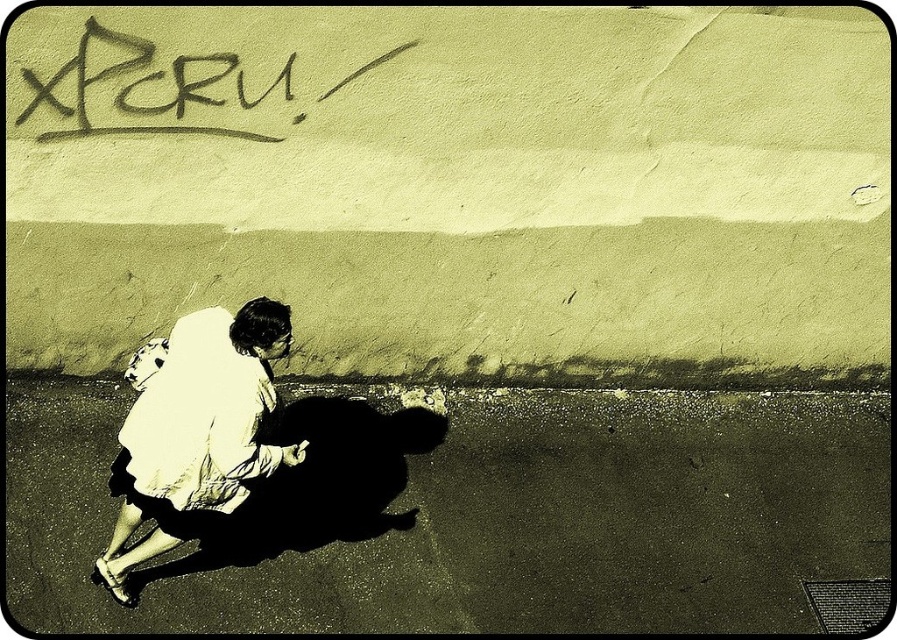
Which of these two, white cotton shirt at lower left or black graffiti at upper left, stands shorter?

black graffiti at upper left is shorter.

Where is `white cotton shirt at lower left`? white cotton shirt at lower left is located at coordinates (197, 433).

Can you confirm if dark asphalt pavement at lower left is positioned above black graffiti at upper left?

No.

Is point (797, 456) positioned in front of point (112, 77)?

No.

Is point (417, 552) closer to camera compared to point (258, 81)?

That is False.

This screenshot has width=897, height=640. Find the location of `dark asphalt pavement at lower left`. dark asphalt pavement at lower left is located at coordinates click(477, 513).

Which of these two, dark asphalt pavement at lower left or white cotton shirt at lower left, stands shorter?

Standing shorter between the two is dark asphalt pavement at lower left.

You are a GUI agent. You are given a task and a screenshot of the screen. Output one action in this format:
    pyautogui.click(x=<x>, y=<y>)
    Task: Click on the dark asphalt pavement at lower left
    Image resolution: width=897 pixels, height=640 pixels.
    Given the screenshot: What is the action you would take?
    pyautogui.click(x=477, y=513)

Is point (518, 417) more distant than point (237, 353)?

That is True.

Where is `dark asphalt pavement at lower left`? dark asphalt pavement at lower left is located at coordinates (477, 513).